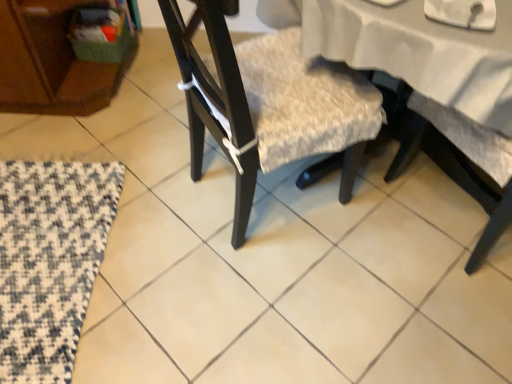
Question: Can you confirm if black woven mat at lower left is shorter than textured beige cushion at center?

Choices:
 (A) no
 (B) yes

Answer: (B)

Question: Is there a large distance between black woven mat at lower left and textured beige cushion at center?

Choices:
 (A) no
 (B) yes

Answer: (A)

Question: From the image's perspective, does black woven mat at lower left appear higher than textured beige cushion at center?

Choices:
 (A) yes
 (B) no

Answer: (B)

Question: Is black woven mat at lower left smaller than textured beige cushion at center?

Choices:
 (A) no
 (B) yes

Answer: (B)

Question: Is textured beige cushion at center a part of black woven mat at lower left?

Choices:
 (A) no
 (B) yes

Answer: (A)

Question: Is black woven mat at lower left positioned behind textured beige cushion at center?

Choices:
 (A) no
 (B) yes

Answer: (B)

Question: From the image's perspective, is textured beige cushion at center over black woven mat at lower left?

Choices:
 (A) no
 (B) yes

Answer: (B)

Question: Can you confirm if textured beige cushion at center is bigger than black woven mat at lower left?

Choices:
 (A) yes
 (B) no

Answer: (A)

Question: Is textured beige cushion at center facing towards black woven mat at lower left?

Choices:
 (A) no
 (B) yes

Answer: (A)

Question: Is textured beige cushion at center shorter than black woven mat at lower left?

Choices:
 (A) yes
 (B) no

Answer: (B)

Question: Is textured beige cushion at center positioned in front of black woven mat at lower left?

Choices:
 (A) no
 (B) yes

Answer: (B)

Question: Is textured beige cushion at center not within black woven mat at lower left?

Choices:
 (A) no
 (B) yes

Answer: (B)

Question: From a real-world perspective, is black woven mat at lower left positioned above or below textured beige cushion at center?

Choices:
 (A) below
 (B) above

Answer: (A)